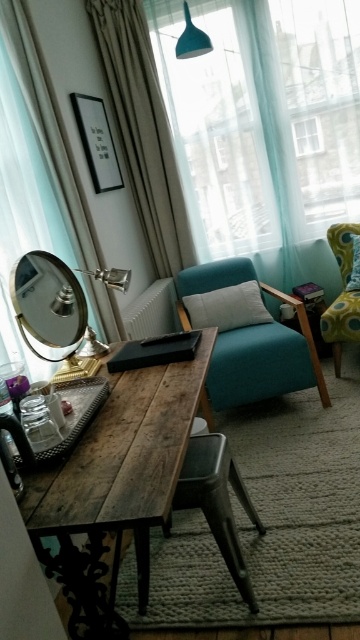
Question: Which object is closer to the camera taking this photo?

Choices:
 (A) teal fabric couch at center
 (B) metallic silver chair at center
 (C) floral fabric pillow at center
 (D) blue matte lampshade at upper center

Answer: (B)

Question: Which point is farther to the camera?

Choices:
 (A) light gray fabric pillow at center
 (B) metallic silver chair at center

Answer: (A)

Question: In this image, where is white sheer curtain at left located relative to green polka dot fabric armchair at right?

Choices:
 (A) below
 (B) above

Answer: (B)

Question: Which point is farther to the camera?

Choices:
 (A) white sheer curtain at left
 (B) transparent glass window at upper center
 (C) blue matte lampshade at upper center

Answer: (B)

Question: Is beige fabric curtain at upper left bigger than transparent glass window at upper center?

Choices:
 (A) no
 (B) yes

Answer: (B)

Question: Can you confirm if rustic wood table at center is positioned below green polka dot fabric armchair at right?

Choices:
 (A) yes
 (B) no

Answer: (A)